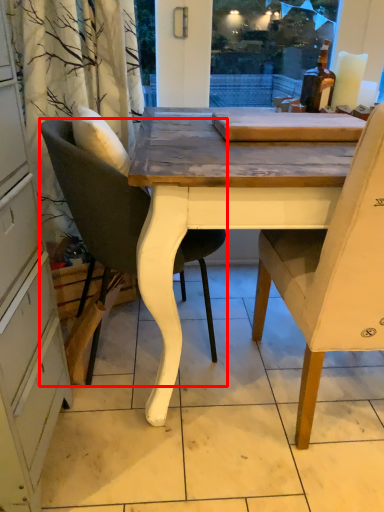
Question: From the image's perspective, considering the relative positions of chair (annotated by the red box) and chair in the image provided, where is chair (annotated by the red box) located with respect to the staircase?

Choices:
 (A) below
 (B) above

Answer: (B)